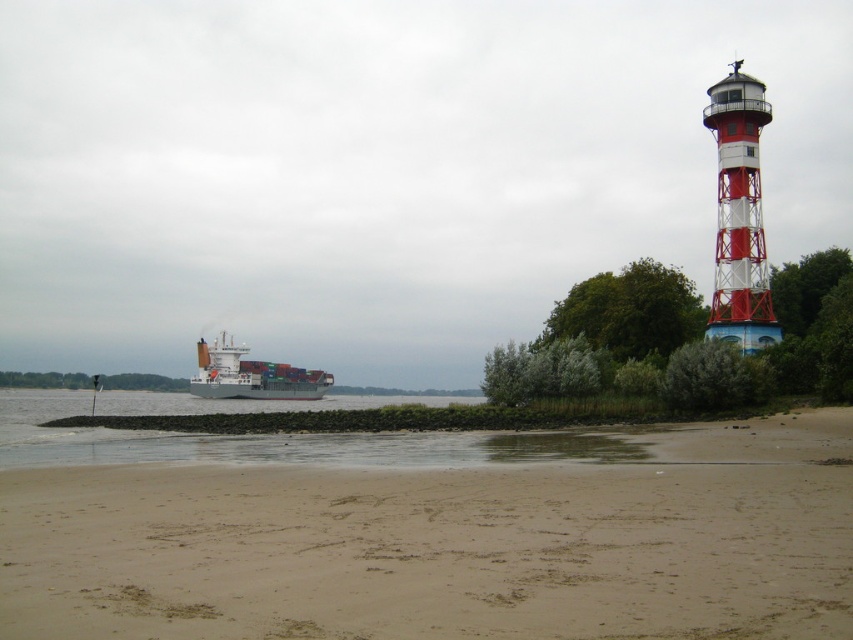
You are standing at the edge of the beach looking towards the lighthouse. Which object is closer to you, the sandy at lower center or the red and white striped lighthouse at upper right?

The sandy at lower center is closer to the viewer than the red and white striped lighthouse at upper right according to the description.

You are standing at the sandy at lower center and want to see the gray matte container ship at left. Which direction should you look to see it?

You should look to the left because the gray matte container ship at left is positioned to the left of the sandy at lower center.

You are a sailor on the gray matte container ship at left and want to navigate towards the red and white striped lighthouse at upper right. From your current position, which direction should you steer to approach the lighthouse?

The red and white striped lighthouse at upper right is in front of the gray matte container ship at left, so you should steer towards the direction where the lighthouse is positioned in front of the ship to approach it.